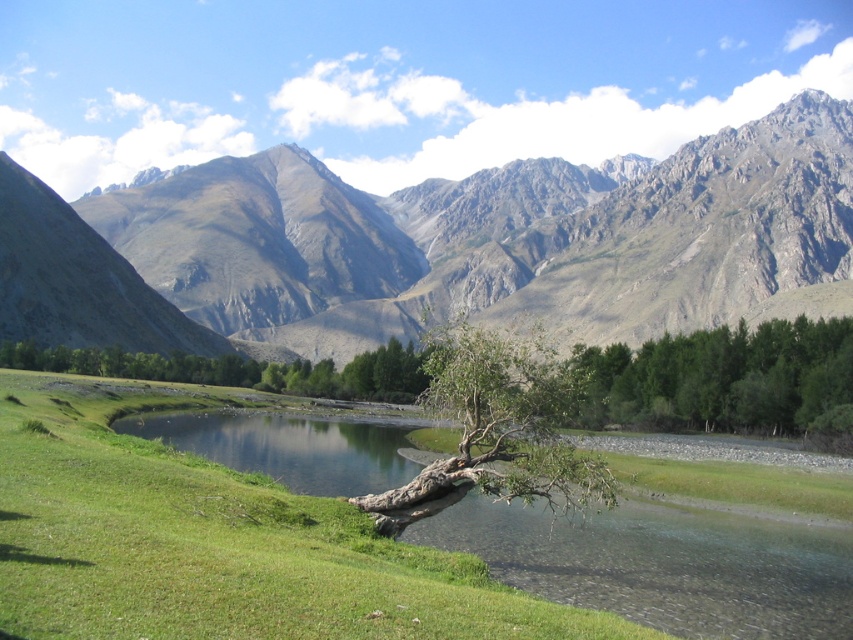
Does clear water at center appear on the left side of brown rough tree trunk at lower center?

Yes, clear water at center is to the left of brown rough tree trunk at lower center.

Can you confirm if clear water at center is smaller than brown rough tree trunk at lower center?

Actually, clear water at center might be larger than brown rough tree trunk at lower center.

This screenshot has width=853, height=640. Describe the element at coordinates (663, 564) in the screenshot. I see `clear water at center` at that location.

Where is `clear water at center`? This screenshot has width=853, height=640. clear water at center is located at coordinates (663, 564).

Does clear water at center appear under green leafy trees at lower right?

Yes.

Which is more to the right, clear water at center or green leafy trees at lower right?

green leafy trees at lower right

Between point (469, 548) and point (665, 371), which one is positioned in front?

Point (469, 548) is in front.

The image size is (853, 640). I want to click on clear water at center, so click(663, 564).

Which of these two, green leafy trees at lower right or brown rough tree trunk at lower center, stands shorter?

Standing shorter between the two is brown rough tree trunk at lower center.

How much distance is there between green leafy trees at lower right and brown rough tree trunk at lower center?

The distance of green leafy trees at lower right from brown rough tree trunk at lower center is 70.87 meters.

This screenshot has width=853, height=640. I want to click on green leafy trees at lower right, so click(717, 378).

At what (x,y) coordinates should I click in order to perform the action: click on green leafy trees at lower right. Please return your answer as a coordinate pair (x, y). Looking at the image, I should click on (717, 378).